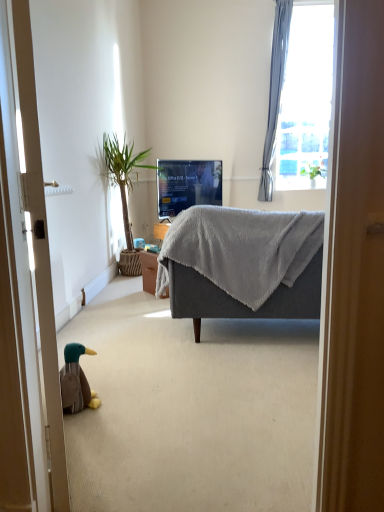
Where is `free space behind wooden door at left`? Image resolution: width=384 pixels, height=512 pixels. free space behind wooden door at left is located at coordinates (123, 395).